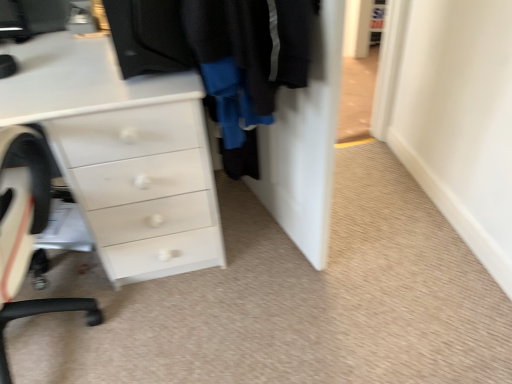
Image resolution: width=512 pixels, height=384 pixels. I want to click on white glossy chest of drawers at center, so click(x=123, y=153).

Locate an element on the screen. white plastic chair at left is located at coordinates (26, 231).

Is white plastic chair at left at the back of black fabric door at center?

No, black fabric door at center is not facing the opposite direction of white plastic chair at left.

Does point (333, 59) appear closer or farther from the camera than point (35, 158)?

Point (333, 59) is positioned closer to the camera compared to point (35, 158).

Can you confirm if black fabric door at center is bigger than white plastic chair at left?

Incorrect, black fabric door at center is not larger than white plastic chair at left.

Looking at this image, from the image's perspective, which object appears higher, black fabric door at center or white plastic chair at left?

black fabric door at center.

From a real-world perspective, is white plastic chair at left positioned over black fabric door at center based on gravity?

Yes, from a real-world perspective, white plastic chair at left is above black fabric door at center.

Can you tell me how much white plastic chair at left and black fabric door at center differ in facing direction?

104 degrees separate the facing orientations of white plastic chair at left and black fabric door at center.

Can you confirm if white plastic chair at left is positioned to the left of black fabric door at center?

Yes, white plastic chair at left is to the left of black fabric door at center.

From the image's perspective, is white plastic chair at left positioned above or below black fabric door at center?

Based on their image positions, white plastic chair at left is located beneath black fabric door at center.

From the picture: Is white glossy chest of drawers at center wider or thinner than black fabric door at center?

white glossy chest of drawers at center is wider than black fabric door at center.

From a real-world perspective, between white glossy chest of drawers at center and black fabric door at center, who is vertically lower?

white glossy chest of drawers at center, from a real-world perspective.

From the picture: From the image's perspective, is white glossy chest of drawers at center beneath black fabric door at center?

Yes.

How different are the orientations of white glossy chest of drawers at center and black fabric door at center in degrees?

74.1 degrees.

Consider the image. Which of these two, white plastic chair at left or white glossy chest of drawers at center, is wider?

white plastic chair at left is wider.

From a real-world perspective, who is located lower, white plastic chair at left or white glossy chest of drawers at center?

white glossy chest of drawers at center.

Is point (20, 209) less distant than point (165, 124)?

No, (20, 209) is further to viewer.

Is white plastic chair at left not close to white glossy chest of drawers at center?

No, there isn't a large distance between white plastic chair at left and white glossy chest of drawers at center.

Locate an element on the screen. Image resolution: width=512 pixels, height=384 pixels. computer chair above the white glossy chest of drawers at center (from a real-world perspective) is located at coordinates (26, 231).

Is white glossy chest of drawers at center oriented away from white plastic chair at left?

No, white plastic chair at left is not at the back of white glossy chest of drawers at center.

Is white glossy chest of drawers at center shorter than white plastic chair at left?

Correct, white glossy chest of drawers at center is not as tall as white plastic chair at left.

Considering the sizes of objects white glossy chest of drawers at center and white plastic chair at left in the image provided, who is bigger, white glossy chest of drawers at center or white plastic chair at left?

white glossy chest of drawers at center.

Would you consider black fabric door at center to be distant from white glossy chest of drawers at center?

black fabric door at center is near white glossy chest of drawers at center, not far away.

This screenshot has width=512, height=384. In order to click on chest of drawers below the black fabric door at center (from the image's perspective) in this screenshot , I will do `click(123, 153)`.

Looking at the image, does black fabric door at center seem bigger or smaller compared to white glossy chest of drawers at center?

Considering their sizes, black fabric door at center takes up less space than white glossy chest of drawers at center.

Locate an element on the screen. The width and height of the screenshot is (512, 384). computer chair that appears above the black fabric door at center (from a real-world perspective) is located at coordinates pos(26,231).

In the image, there is a black fabric door at center. At what (x,y) coordinates should I click in order to perform the action: click on computer chair below it (from the image's perspective). Please return your answer as a coordinate pair (x, y). Looking at the image, I should click on (26, 231).

When comparing their distances from white glossy chest of drawers at center, does white plastic chair at left or black fabric door at center seem closer?

The object closer to white glossy chest of drawers at center is white plastic chair at left.

When comparing their distances from black fabric door at center, does white glossy chest of drawers at center or white plastic chair at left seem closer?

white glossy chest of drawers at center is positioned closer to the anchor black fabric door at center.

Based on their spatial positions, is white plastic chair at left or white glossy chest of drawers at center further from black fabric door at center?

white plastic chair at left is positioned further to the anchor black fabric door at center.

Considering their positions, is black fabric door at center positioned closer to white glossy chest of drawers at center than white plastic chair at left?

white plastic chair at left.

Based on their spatial positions, is black fabric door at center or white glossy chest of drawers at center closer to white plastic chair at left?

white glossy chest of drawers at center.

From the image, which object appears to be nearer to white plastic chair at left, white glossy chest of drawers at center or black fabric door at center?

Among the two, white glossy chest of drawers at center is located nearer to white plastic chair at left.

Where is `chest of drawers between white plastic chair at left and black fabric door at center in the horizontal direction`? The image size is (512, 384). chest of drawers between white plastic chair at left and black fabric door at center in the horizontal direction is located at coordinates (123, 153).